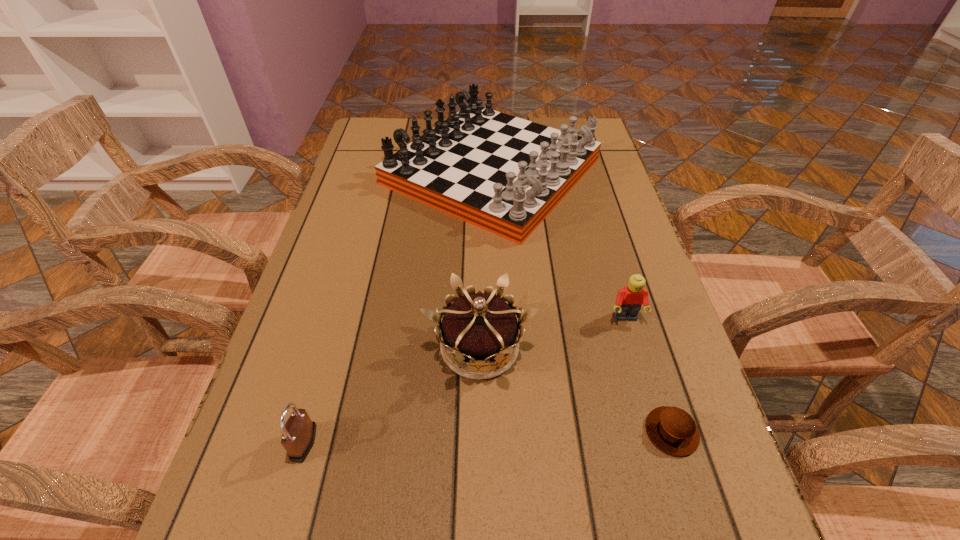
At what (x,y) coordinates should I click in order to perform the action: click on free point between the crown and the muffin. Please return your answer as a coordinate pair (x, y). Looking at the image, I should click on (576, 389).

What are the coordinates of `object that is the second closest to the muffin` in the screenshot? It's located at point(629,299).

Locate which object ranks in proximity to the padlock. Please provide its 2D coordinates. Your answer should be formatted as a tuple, i.e. [(x, y)], where the tuple contains the x and y coordinates of a point satisfying the conditions above.

[(479, 327)]

Identify the location of blank area in the image that satisfies the following two spatial constraints: 1. on the face of the shortest object; 2. on the left side of the Lego. This screenshot has height=540, width=960. (659, 431).

Image resolution: width=960 pixels, height=540 pixels. I want to click on vacant area that satisfies the following two spatial constraints: 1. on the front side of the shortest object; 2. on the right side of the gameboard, so click(500, 431).